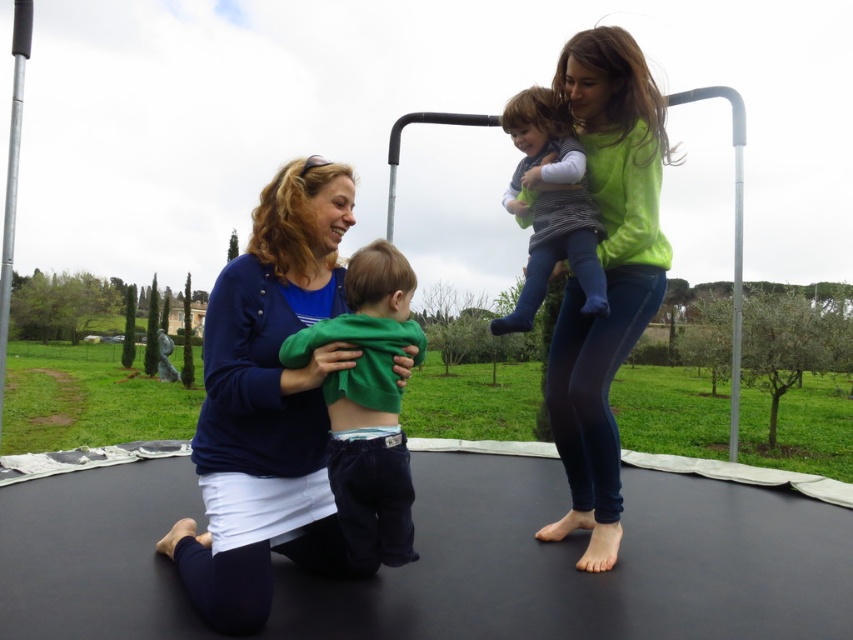
Question: Does blue fabric at center lie in front of striped knit sweater at upper center?

Choices:
 (A) yes
 (B) no

Answer: (A)

Question: Estimate the real-world distances between objects in this image. Which object is farther from the green matte hoodie at center?

Choices:
 (A) striped knit sweater at upper center
 (B) blue fabric at center
 (C) green matte sweater at upper right

Answer: (C)

Question: Which object is closer to the camera taking this photo?

Choices:
 (A) striped knit sweater at upper center
 (B) blue fabric at center
 (C) green matte sweater at upper right

Answer: (B)

Question: In this image, where is blue fabric at center located relative to green matte sweater at upper right?

Choices:
 (A) right
 (B) left

Answer: (B)

Question: Estimate the real-world distances between objects in this image. Which object is farther from the blue fabric at center?

Choices:
 (A) green matte sweater at upper right
 (B) striped knit sweater at upper center
 (C) green matte hoodie at center

Answer: (A)

Question: Can you confirm if blue fabric at center is thinner than striped knit sweater at upper center?

Choices:
 (A) no
 (B) yes

Answer: (A)